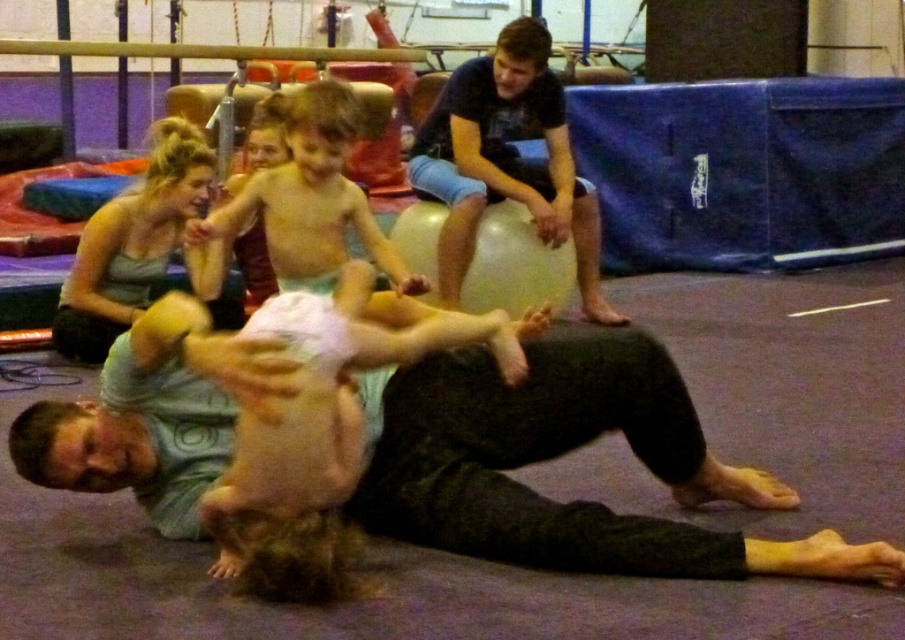
Between light green t-shirt at center and smooth skin child at center, which one appears on the right side from the viewer's perspective?

Positioned to the right is light green t-shirt at center.

Which is above, light green t-shirt at center or smooth skin child at center?

smooth skin child at center is above.

Measure the distance between point (x=380, y=529) and camera.

Point (x=380, y=529) and camera are 9.45 feet apart.

Where is `light green t-shirt at center`? The image size is (905, 640). light green t-shirt at center is located at coordinates (561, 452).

Is point (532, 97) behind point (191, 124)?

No.

This screenshot has width=905, height=640. Describe the element at coordinates (506, 161) in the screenshot. I see `dark blue t-shirt at upper center` at that location.

You are a GUI agent. You are given a task and a screenshot of the screen. Output one action in this format:
    pyautogui.click(x=<x>, y=<y>)
    Task: Click on the dark blue t-shirt at upper center
    
    Given the screenshot: What is the action you would take?
    pyautogui.click(x=506, y=161)

Is light green t-shirt at center shorter than matte green tank top at upper left?

Indeed, light green t-shirt at center has a lesser height compared to matte green tank top at upper left.

Is light green t-shirt at center positioned at the back of matte green tank top at upper left?

No, it is in front of matte green tank top at upper left.

Where is `light green t-shirt at center`? The height and width of the screenshot is (640, 905). light green t-shirt at center is located at coordinates (561, 452).